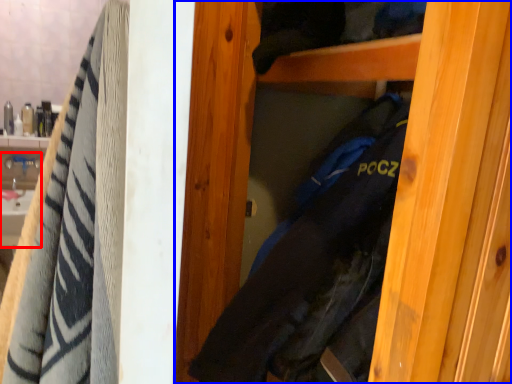
Question: Which object is closer to the camera taking this photo, sink (highlighted by a red box) or door (highlighted by a blue box)?

Choices:
 (A) sink
 (B) door

Answer: (B)